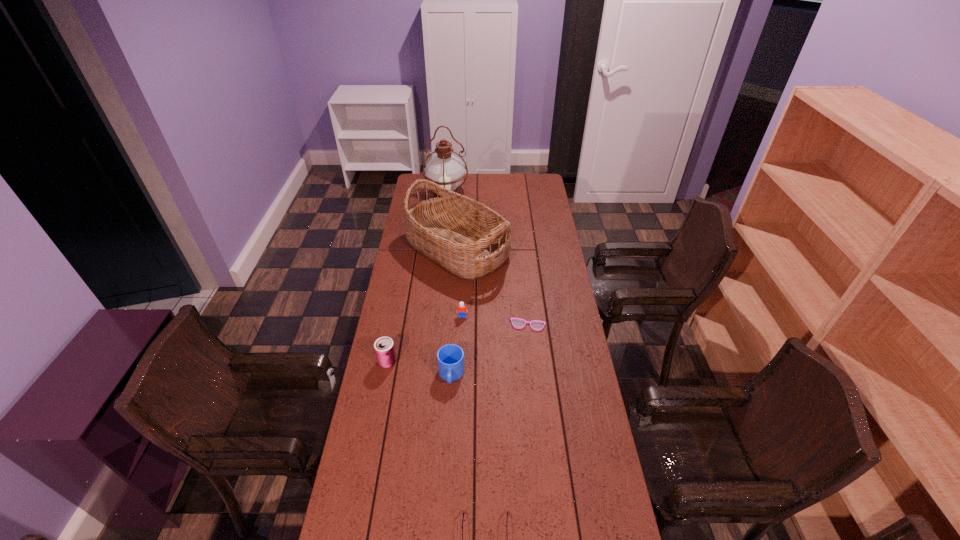
Where is `the farthest object`? the farthest object is located at coordinates (444, 169).

Identify the location of the tallest object. (444, 169).

At what (x,y) coordinates should I click in order to perform the action: click on the sixth nearest object. Please return your answer as a coordinate pair (x, y). This screenshot has height=540, width=960. Looking at the image, I should click on (467, 238).

Where is `the sixth shortest object`? The width and height of the screenshot is (960, 540). the sixth shortest object is located at coordinates click(x=467, y=238).

This screenshot has height=540, width=960. Identify the location of the farther spectacles. pyautogui.click(x=536, y=325).

I want to click on the taller spectacles, so click(x=536, y=325).

This screenshot has height=540, width=960. I want to click on can, so click(x=384, y=348).

The height and width of the screenshot is (540, 960). I want to click on mug, so click(450, 357).

Image resolution: width=960 pixels, height=540 pixels. Identify the location of the sixth tallest object. (462, 309).

Find the location of a particular element. Image resolution: width=960 pixels, height=540 pixels. the fifth nearest object is located at coordinates (462, 309).